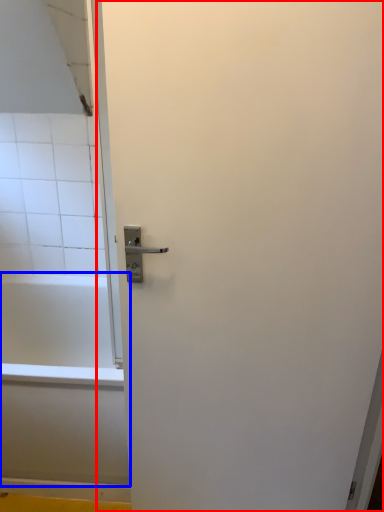
Question: Which of the following is the farthest to the observer, screen door (highlighted by a red box) or bathtub (highlighted by a blue box)?

Choices:
 (A) screen door
 (B) bathtub

Answer: (B)